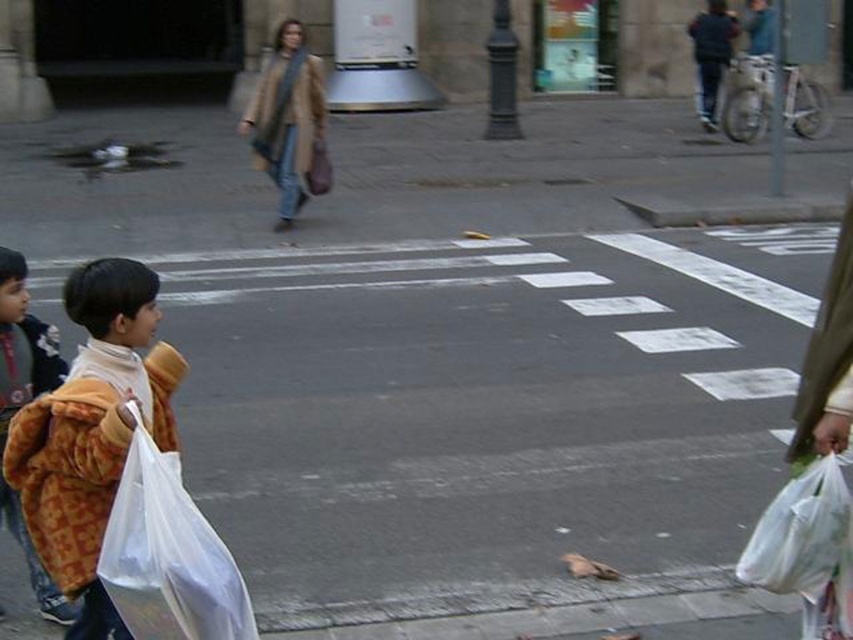
You are a delivery robot positioned at the center of the crosswalk. You need to deliver a package to the white plastic bag at lower left. Based on the scene, which direction should you move to reach it?

The white plastic bag at lower left is located at point (167, 554), so you should move towards the lower left direction to reach it.

You are a delivery person trying to avoid dropping packages. You see the white plastic bag at lower left and the beige wool coat at center. Which object is closer to the ground?

The white plastic bag at lower left is positioned under beige wool coat at center, meaning it is closer to the ground.